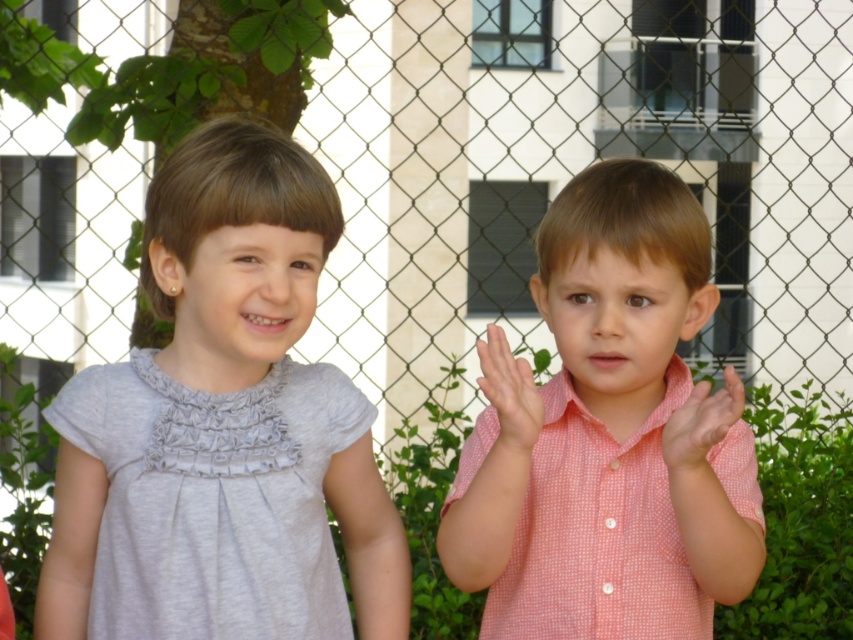
Question: Estimate the real-world distances between objects in this image. Which object is farther from the pink checkered shirt at center?

Choices:
 (A) pink dotted shirt at center
 (B) gray matte dress at left
 (C) pink checkered shirt at right

Answer: (B)

Question: Is gray matte dress at left below pink dotted shirt at center?

Choices:
 (A) yes
 (B) no

Answer: (B)

Question: Is the position of pink checkered shirt at center more distant than that of pink checkered shirt at right?

Choices:
 (A) yes
 (B) no

Answer: (A)

Question: Considering the real-world distances, which object is closest to the pink dotted shirt at center?

Choices:
 (A) gray matte dress at left
 (B) pink checkered shirt at right
 (C) pink checkered shirt at center

Answer: (C)

Question: Which object is closer to the camera taking this photo?

Choices:
 (A) gray matte dress at left
 (B) pink checkered shirt at right

Answer: (B)

Question: In this image, where is pink checkered shirt at center located relative to pink checkered shirt at right?

Choices:
 (A) above
 (B) below

Answer: (B)